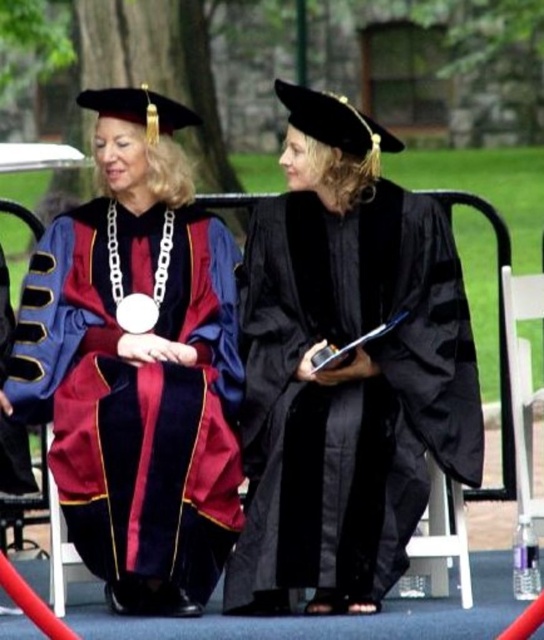
Is maroon velvet gown at center above black matte graduation gown at center?

Indeed, maroon velvet gown at center is positioned over black matte graduation gown at center.

Between maroon velvet gown at center and black matte graduation gown at center, which one is positioned lower?

black matte graduation gown at center is lower down.

Is point (191, 214) more distant than point (318, 460)?

That is True.

This screenshot has height=640, width=544. Find the location of `maroon velvet gown at center`. maroon velvet gown at center is located at coordinates (138, 364).